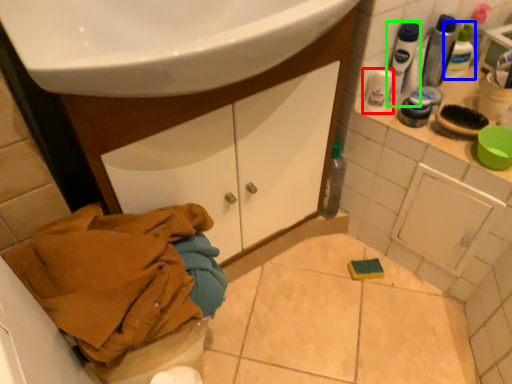
Question: Considering the real-world distances, which object is closest to mouthwash (highlighted by a red box)? mouthwash (highlighted by a blue box) or mouthwash (highlighted by a green box).

Choices:
 (A) mouthwash
 (B) mouthwash

Answer: (B)